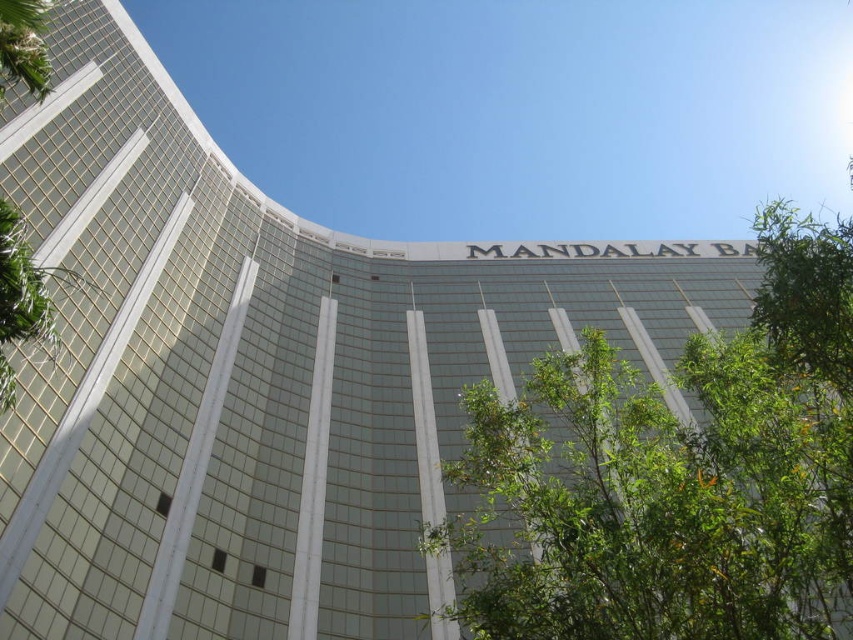
Is green leafy tree at center to the left of green leafy tree at left from the viewer's perspective?

Incorrect, green leafy tree at center is not on the left side of green leafy tree at left.

Find the location of a particular element. The image size is (853, 640). green leafy tree at center is located at coordinates (674, 476).

Who is more distant from viewer, (738,513) or (6,352)?

The point (6,352) is behind.

The width and height of the screenshot is (853, 640). Identify the location of green leafy tree at center. (674, 476).